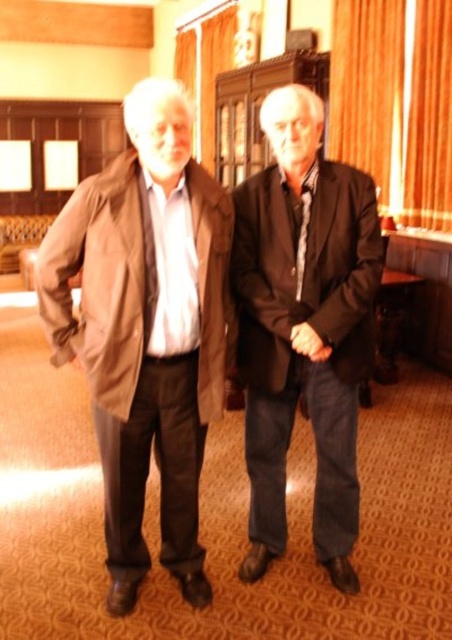
You are standing in the room and want to pick up the brown leather jacket at center. Which direction should you move to reach it?

The brown leather jacket at center is located at point coordinates, so you should move towards the center of the room to reach it.